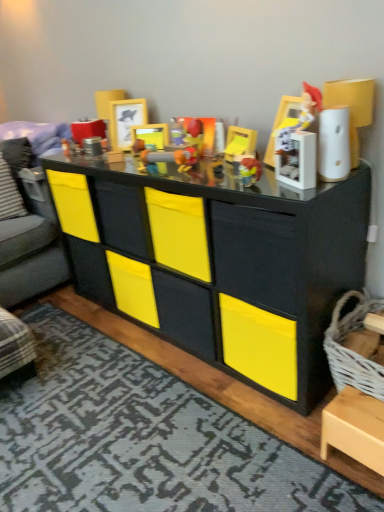
The height and width of the screenshot is (512, 384). Find the location of `free location to the right of translucent plastic toy at center, arranged as the 2th toy when viewed from the right`. free location to the right of translucent plastic toy at center, arranged as the 2th toy when viewed from the right is located at coordinates (289, 179).